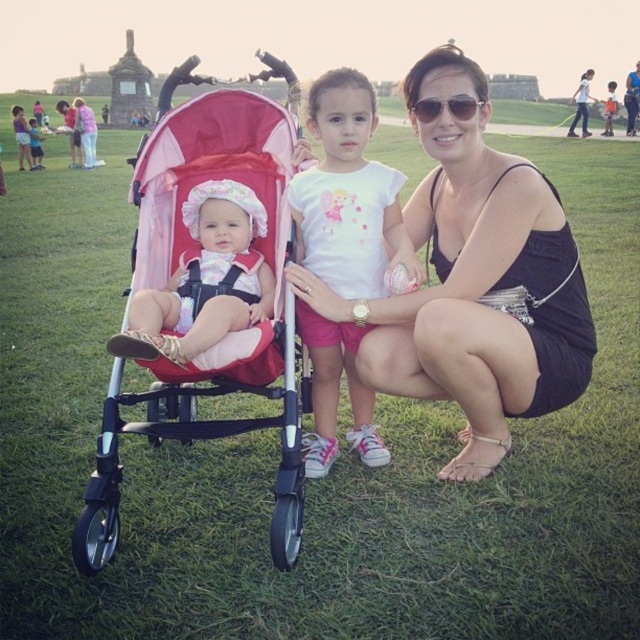
You are a photographer setting up for a family photo. You need to position the black satin dress at center and the matte pink stroller at left so they both fit within the frame. Based on their sizes, would you need to adjust the camera angle to ensure both objects are fully visible?

The black satin dress at center might be wider than the matte pink stroller at left, so adjusting the camera angle might be necessary to ensure both objects are fully visible in the frame.

You are a photographer setting up for a family photo. You see the black satin dress at center and the white cotton shirt at center. Which clothing item is positioned to the right of the other?

The black satin dress at center is to the right of the white cotton shirt at center.